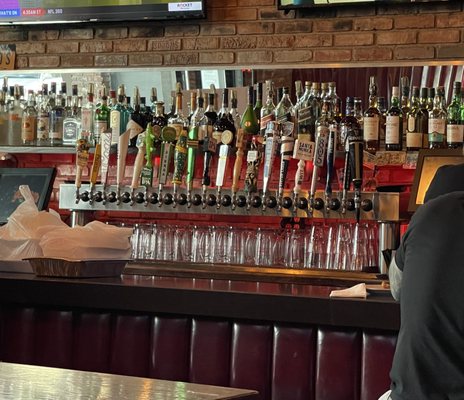
At what (x,y) coordinates should I click in order to perform the action: click on red brick wall. Please return your answer as a coordinate pair (x, y). The image size is (464, 400). Looking at the image, I should click on [49, 48].